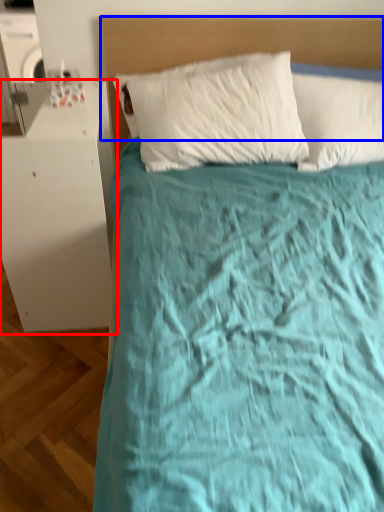
Question: Which of the following is the farthest to the observer, table (highlighted by a red box) or headboard (highlighted by a blue box)?

Choices:
 (A) table
 (B) headboard

Answer: (B)